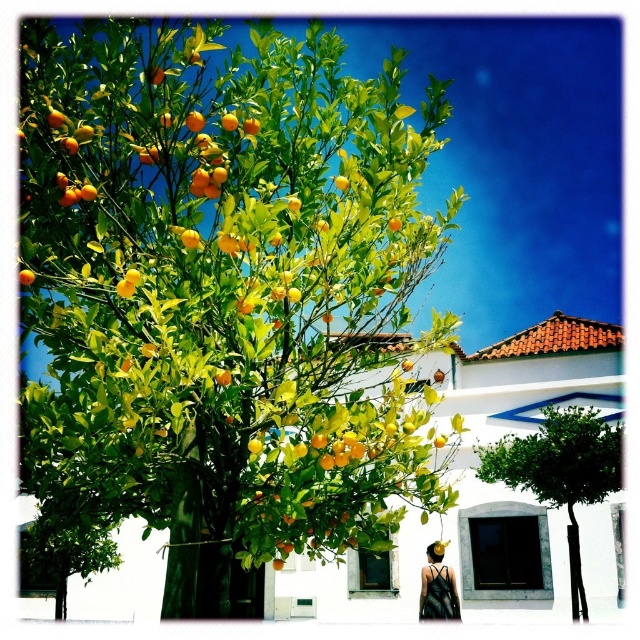
You are standing in the garden and want to pick an orange from the tree. Which tree should you approach first, the green leafy fruit tree at center or the green leafy tree at center?

The green leafy fruit tree at center is closer to the viewer than the green leafy tree at center, so you should approach the green leafy fruit tree at center first.

You are standing in the garden and notice the green leafy fruit tree at center and the matte black dress at lower right. Which object is positioned higher in the scene?

The green leafy fruit tree at center is positioned higher than the matte black dress at lower right.

You are standing in the garden looking at the green leafy fruit tree at center and the green leafy tree at center. Which one is positioned higher in the image?

The green leafy fruit tree at center is located above the green leafy tree at center, so it is positioned higher in the image.